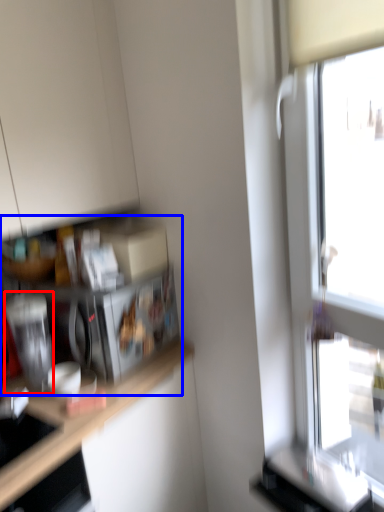
Question: Which of the following is the closest to the observer, appliance (highlighted by a red box) or shelf (highlighted by a blue box)?

Choices:
 (A) appliance
 (B) shelf

Answer: (A)